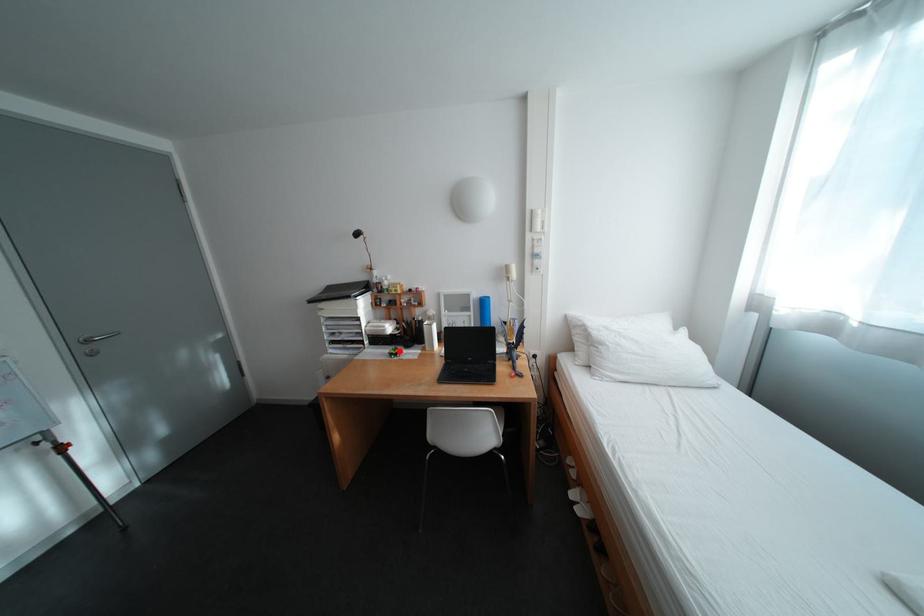
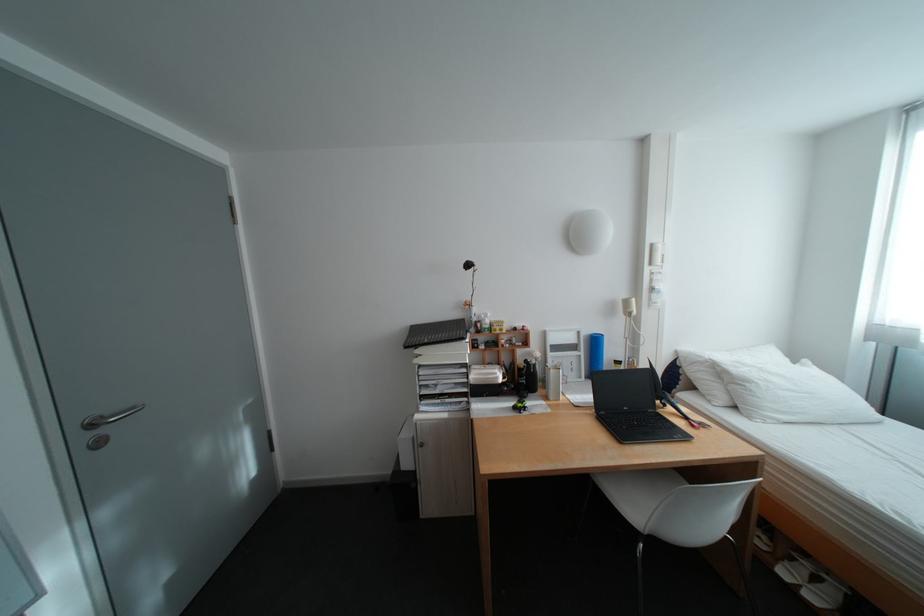
Locate, in the second image, the point that corresponds to the highlighted location in the first image.

(523, 403)